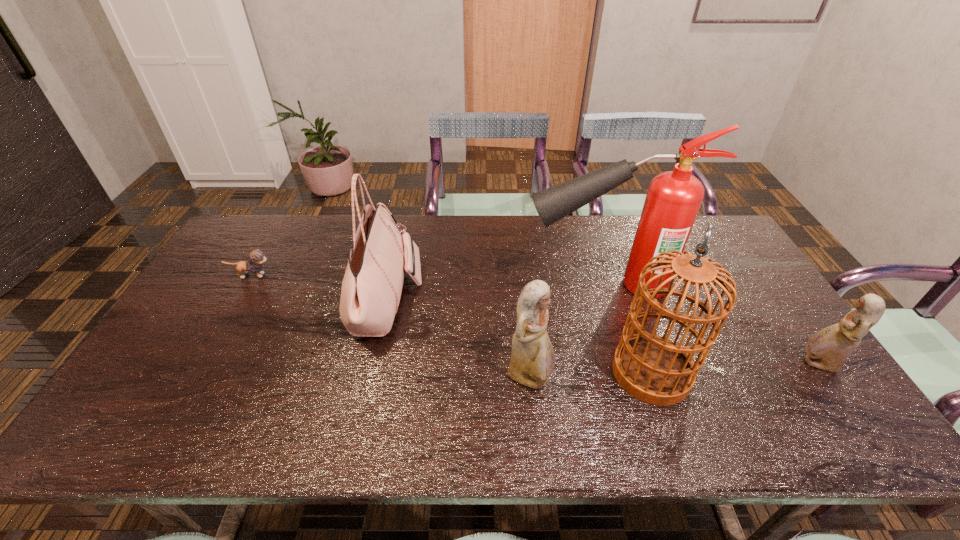
The image size is (960, 540). Identify the location of vacant spot to place a figurine on the left. tap(226, 395).